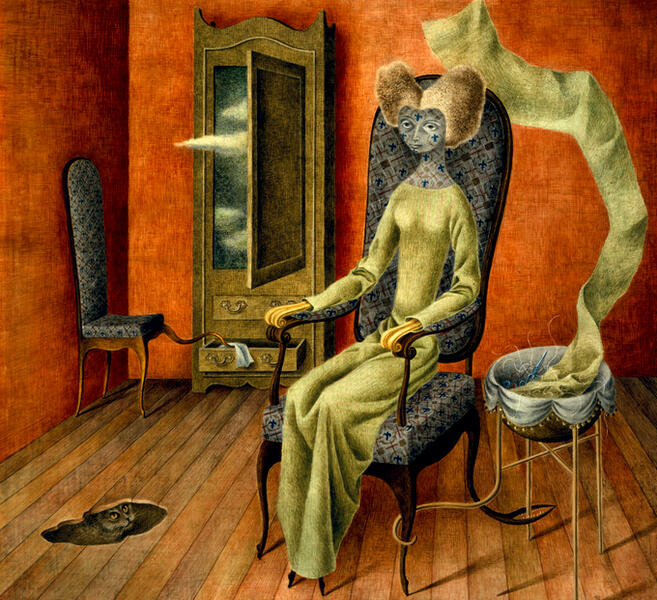
Image resolution: width=657 pixels, height=600 pixels. What are the coordinates of `chair leg` in the screenshot? It's located at (189, 343).